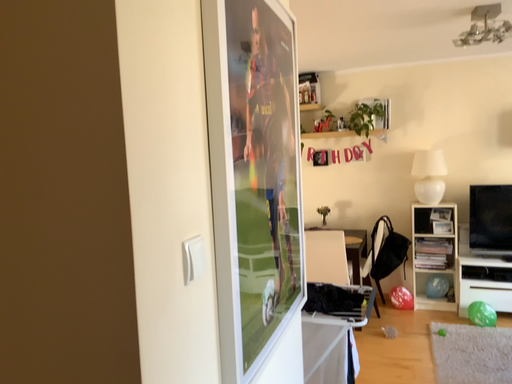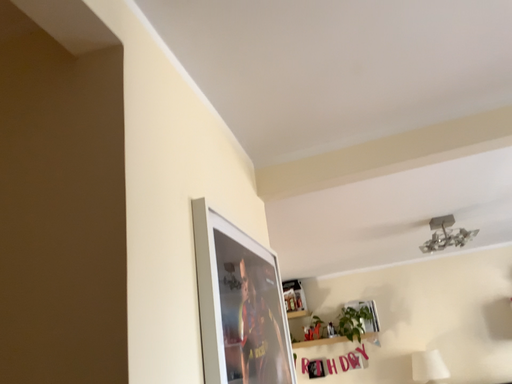
Question: How did the camera likely rotate when shooting the video?

Choices:
 (A) rotated downward
 (B) rotated upward

Answer: (B)